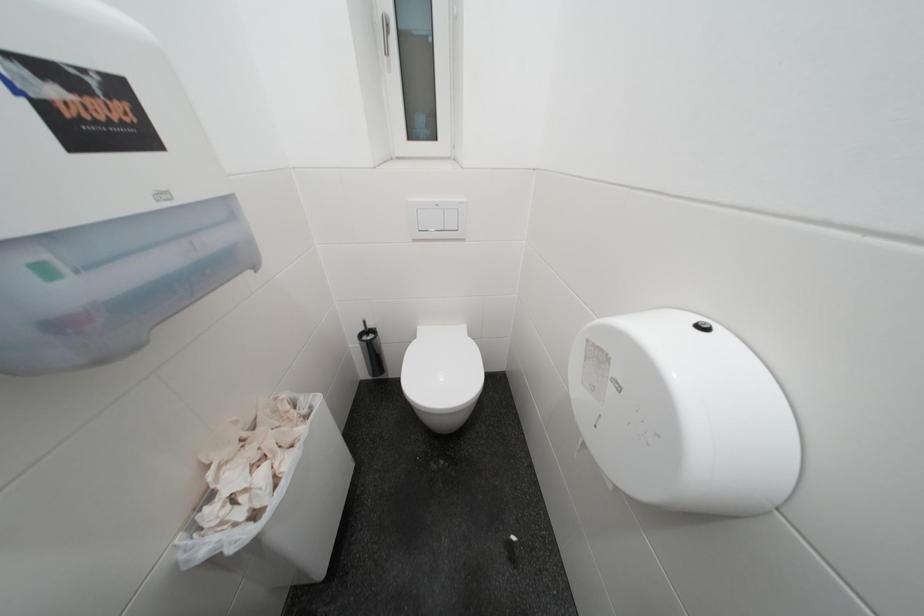
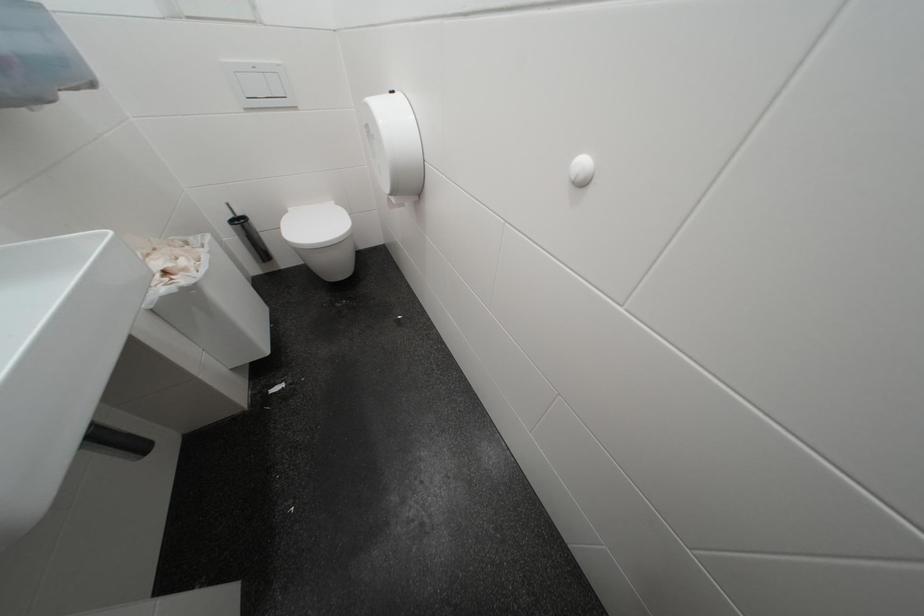
Based on the continuous images, in which direction is the camera rotating?

The camera rotated toward right-down.